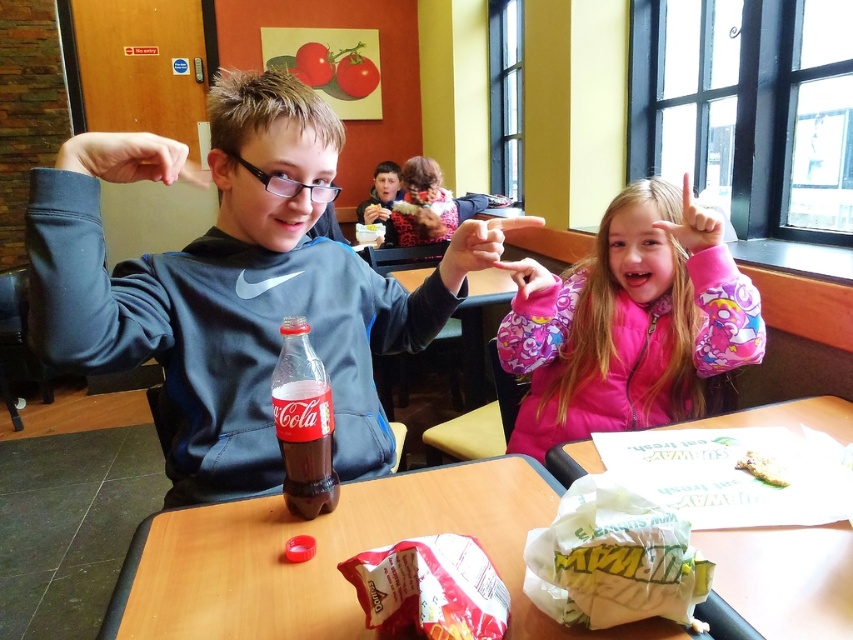
Does pink fleece jacket at center appear over matte black shirt at center?

No, pink fleece jacket at center is not above matte black shirt at center.

Who is more distant from viewer, (697, 387) or (376, 211)?

Point (376, 211)

Identify the location of pink fleece jacket at center. [628, 323].

Who is taller, translucent plastic coca-cola bottle at center or white paper napkin at upper center?

With more height is translucent plastic coca-cola bottle at center.

Which is more to the left, translucent plastic coca-cola bottle at center or white paper napkin at upper center?

Positioned to the left is white paper napkin at upper center.

Which is behind, point (334, 426) or point (383, 225)?

The point (383, 225) is behind.

At what (x,y) coordinates should I click in order to perform the action: click on translucent plastic coca-cola bottle at center. Please return your answer as a coordinate pair (x, y). Looking at the image, I should click on (303, 422).

Between wooden table at center and white paper napkin at upper center, which one is positioned lower?

Positioned lower is wooden table at center.

This screenshot has width=853, height=640. I want to click on wooden table at center, so click(332, 557).

Where is `wooden table at center`? wooden table at center is located at coordinates (332, 557).